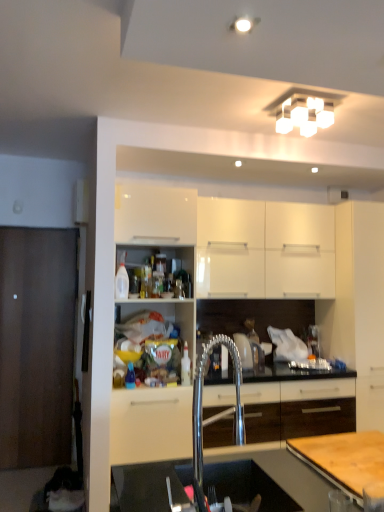
Question: Is point (132, 376) closer or farther from the camera than point (357, 203)?

Choices:
 (A) farther
 (B) closer

Answer: (B)

Question: Would you say translucent plastic bottle at shelf center, positioned as the first bottle in front-to-back order, is inside or outside white matte cabinet at right, marked as the 1th cabinetry in a right-to-left arrangement?

Choices:
 (A) inside
 (B) outside

Answer: (B)

Question: Considering the real-world distances, which object is farthest from the white glossy cabinet at upper center, arranged as the 2th cabinetry when viewed from the right?

Choices:
 (A) white square light fixture at upper center
 (B) translucent plastic bottle at shelf center, marked as the second bottle in a back-to-front arrangement
 (C) white matte cabinet at right, which ranks as the 2th cabinetry in left-to-right order
 (D) polished stainless steel sink at center
 (E) translucent plastic bottle at center, the second bottle when ordered from front to back

Answer: (B)

Question: Considering the real-world distances, which object is farthest from the translucent plastic bottle at shelf center, marked as the 1th bottle in a left-to-right arrangement?

Choices:
 (A) translucent plastic bottle at center, which ranks as the second bottle in left-to-right order
 (B) wooden cutting board at lower right
 (C) white matte cabinet at right, marked as the 1th cabinetry in a right-to-left arrangement
 (D) white glossy cabinet at upper center, arranged as the 2th cabinetry when viewed from the right
 (E) polished stainless steel sink at center

Answer: (C)